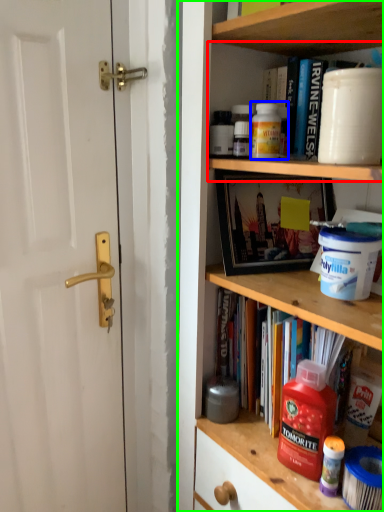
Question: Which object is positioned closest to cabinet (highlighted by a red box)? Select from cleaning product (highlighted by a blue box) and shelf (highlighted by a green box).

Choices:
 (A) cleaning product
 (B) shelf

Answer: (A)